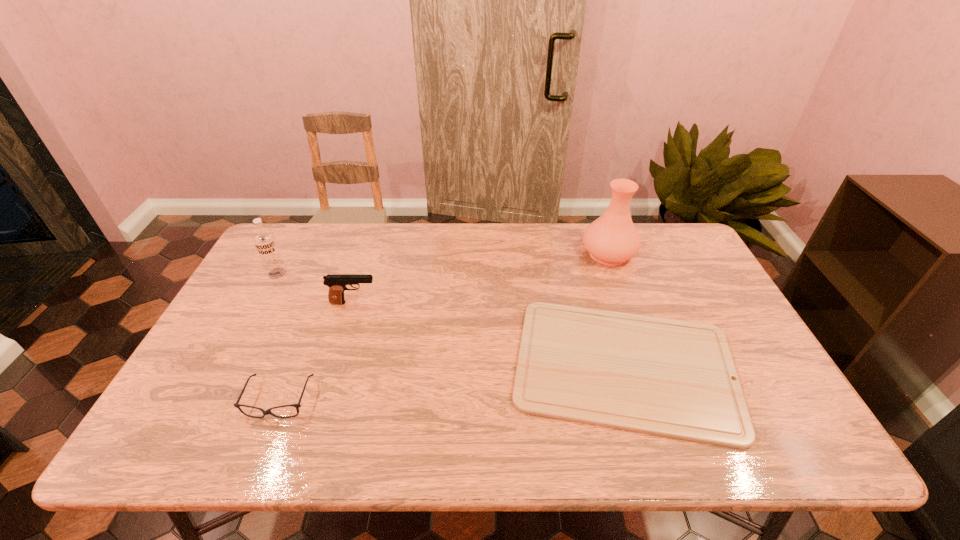
Identify the location of the tallest object. (612, 239).

Identify the location of vodka. This screenshot has height=540, width=960. (264, 240).

The image size is (960, 540). Identify the location of the second tallest object. (264, 240).

Find the location of `pistol`. pistol is located at coordinates (337, 284).

Find the location of a particular element. The height and width of the screenshot is (540, 960). spectacles is located at coordinates (268, 411).

Where is `the shortest object`? Image resolution: width=960 pixels, height=540 pixels. the shortest object is located at coordinates (674, 378).

In order to click on free space located 0.210m on the front of the vase in this screenshot , I will do `click(632, 320)`.

I want to click on blank space located on the front label of the second tallest object, so point(255,315).

Locate an element on the screen. This screenshot has height=540, width=960. vacant space situated 0.260m at the barrel of the pistol is located at coordinates (467, 303).

This screenshot has width=960, height=540. I want to click on blank space located on the front-facing side of the fourth tallest object, so click(x=260, y=448).